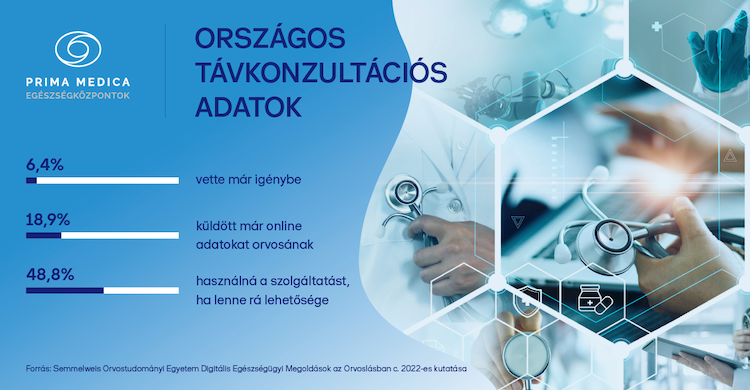
Image resolution: width=750 pixels, height=390 pixels. In order to click on pill bottle in this screenshot , I will do point(586,300).